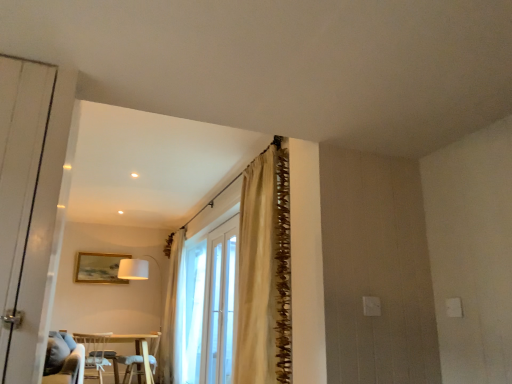
Question: Is gold metallic picture frame at upper center to the right of white glass bay window at center from the viewer's perspective?

Choices:
 (A) yes
 (B) no

Answer: (B)

Question: From the image's perspective, would you say gold metallic picture frame at upper center is positioned over white glass bay window at center?

Choices:
 (A) yes
 (B) no

Answer: (A)

Question: From a real-world perspective, does gold metallic picture frame at upper center stand above white glass bay window at center?

Choices:
 (A) no
 (B) yes

Answer: (B)

Question: Is gold metallic picture frame at upper center shorter than white glass bay window at center?

Choices:
 (A) yes
 (B) no

Answer: (A)

Question: From a real-world perspective, is gold metallic picture frame at upper center positioned under white glass bay window at center based on gravity?

Choices:
 (A) yes
 (B) no

Answer: (B)

Question: Relative to white glass bay window at center, is clear glass door at center in front or behind?

Choices:
 (A) front
 (B) behind

Answer: (A)

Question: Visually, is clear glass door at center positioned to the left or to the right of white glass bay window at center?

Choices:
 (A) right
 (B) left

Answer: (A)

Question: From a real-world perspective, is clear glass door at center above or below white glass bay window at center?

Choices:
 (A) below
 (B) above

Answer: (B)

Question: Would you say clear glass door at center is inside or outside white glass bay window at center?

Choices:
 (A) inside
 (B) outside

Answer: (B)

Question: In the image, is velvet blue armchair at lower center positioned in front of or behind white sheer curtain at center, acting as the first curtain starting from the back?

Choices:
 (A) behind
 (B) front

Answer: (B)

Question: Is point (131, 362) closer or farther from the camera than point (161, 332)?

Choices:
 (A) farther
 (B) closer

Answer: (B)

Question: Considering the positions of velvet blue armchair at lower center and white sheer curtain at center, the 2th curtain from the front, in the image, is velvet blue armchair at lower center taller or shorter than white sheer curtain at center, the 2th curtain from the front,?

Choices:
 (A) tall
 (B) short

Answer: (B)

Question: From a real-world perspective, is velvet blue armchair at lower center positioned above or below white sheer curtain at center, acting as the first curtain starting from the back?

Choices:
 (A) below
 (B) above

Answer: (A)

Question: From a real-world perspective, relative to white fabric chair at lower left, is velvet blue armchair at lower center vertically above or below?

Choices:
 (A) below
 (B) above

Answer: (A)

Question: From the image's perspective, is velvet blue armchair at lower center above or below white fabric chair at lower left?

Choices:
 (A) above
 (B) below

Answer: (B)